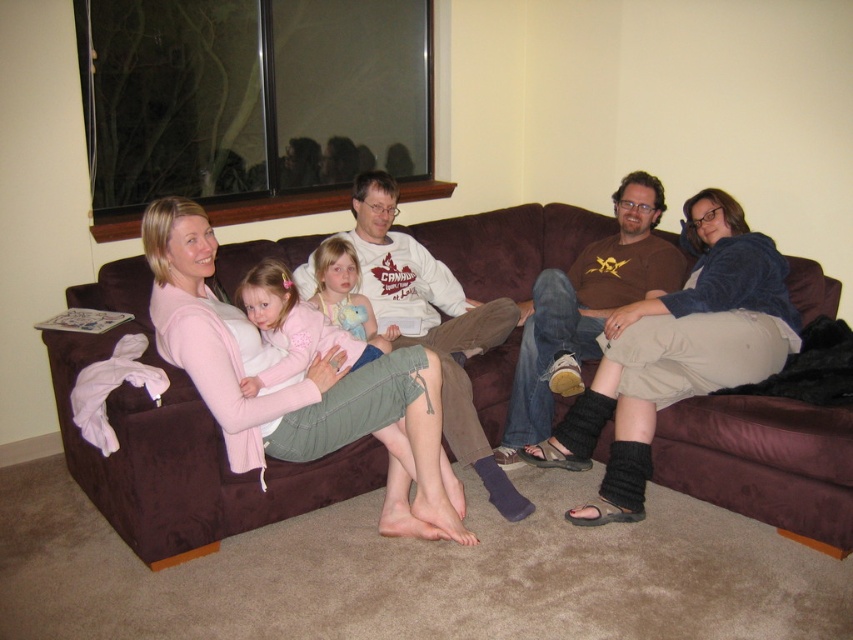
You are standing at the entrance of the living room and see the point marked at coordinates (177,444). Which object in the scene is this point located on?

The point marked at coordinates (177,444) is located on the brown suede couch at center.

You are a fashion designer observing the knit beige socks at center and the matte pink sweater at center in the living room scene. Which item of clothing is larger in size?

The knit beige socks at center is bigger than the matte pink sweater at center.

You are standing in the living room and want to place a small plant on the brown suede couch at center. However, there is a matte pink sweater at center already there. Can you put the plant on the couch without moving the sweater?

The brown suede couch at center is below matte pink sweater at center, which means the sweater is placed on the couch. Therefore, you can place the small plant on the couch alongside the matte pink sweater at center as long as there is enough space.